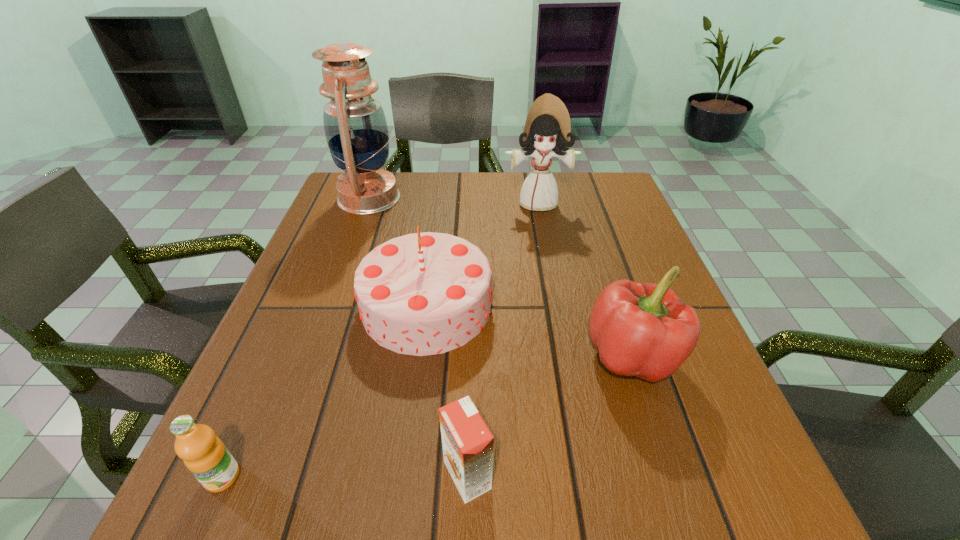
This screenshot has height=540, width=960. Find the location of `the tallest object`. the tallest object is located at coordinates (356, 131).

Where is `the fifth shortest object`? Image resolution: width=960 pixels, height=540 pixels. the fifth shortest object is located at coordinates (547, 126).

Find the location of a particular element. This screenshot has width=960, height=540. birthday cake is located at coordinates (420, 294).

The width and height of the screenshot is (960, 540). What are the coordinates of `bell pepper` in the screenshot? It's located at (645, 330).

At what (x,y) coordinates should I click in order to perform the action: click on the left orange juice. Please return your answer as a coordinate pair (x, y). The width and height of the screenshot is (960, 540). Looking at the image, I should click on click(204, 454).

Locate an element on the screen. This screenshot has width=960, height=540. the right orange juice is located at coordinates (468, 444).

At what (x,y) coordinates should I click in order to perform the action: click on free region located on the front of the oil lamp. Please return your answer as a coordinate pair (x, y). The width and height of the screenshot is (960, 540). Looking at the image, I should click on (334, 294).

Locate an element on the screen. The height and width of the screenshot is (540, 960). vacant space located 0.160m at the front face of the doll is located at coordinates (547, 254).

The width and height of the screenshot is (960, 540). I want to click on free region located 0.280m on the front of the fourth shortest object, so click(397, 531).

In order to click on free space located on the back of the third shortest object in this screenshot , I will do `click(589, 228)`.